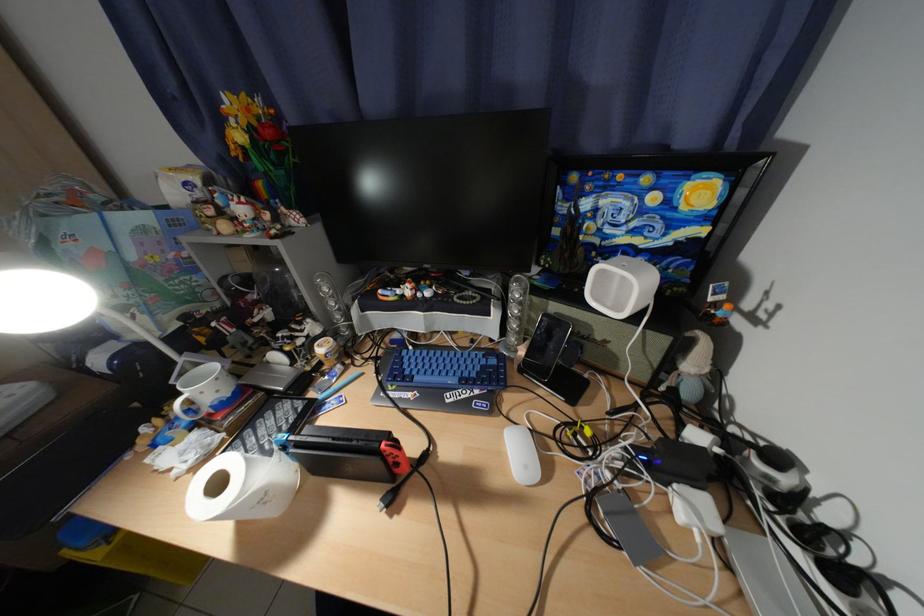
Image resolution: width=924 pixels, height=616 pixels. Describe the element at coordinates (766, 576) in the screenshot. I see `the white cube heater` at that location.